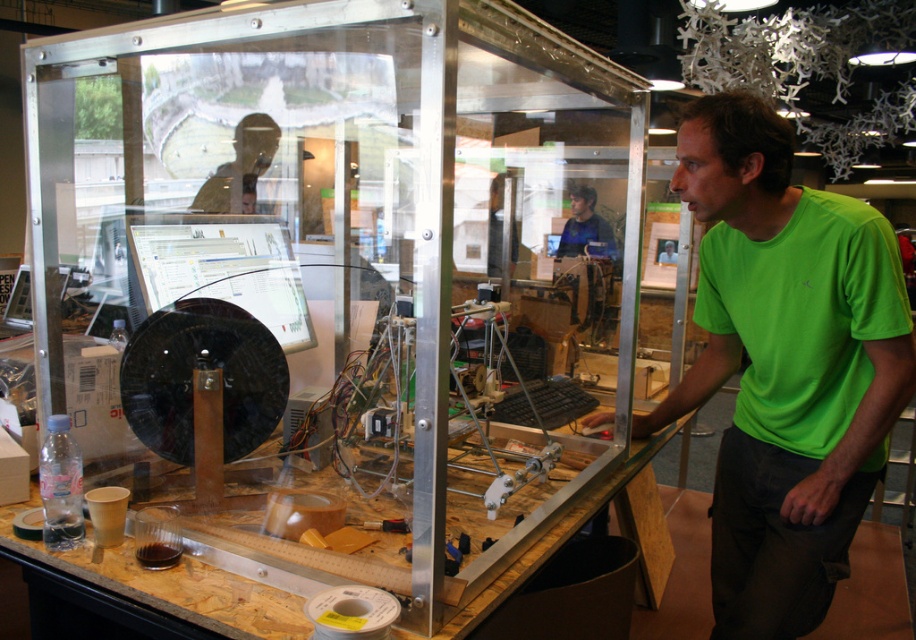
Question: Which point is farther from the camera taking this photo?

Choices:
 (A) (813, 349)
 (B) (367, 550)
 (C) (576, 188)
 (D) (249, 195)

Answer: (C)

Question: Which object is the farthest from the matte black laptop at upper left?

Choices:
 (A) green matte shirt at center
 (B) blue fabric shirt at center
 (C) transparent acrylic glass box at center

Answer: (B)

Question: Does transparent acrylic glass box at center have a larger size compared to green matte shirt at center?

Choices:
 (A) yes
 (B) no

Answer: (A)

Question: Which point appears farthest from the camera in this image?

Choices:
 (A) (240, 200)
 (B) (781, 589)
 (C) (585, 248)

Answer: (C)

Question: Does transparent acrylic glass box at center have a smaller size compared to green matte shirt at center?

Choices:
 (A) no
 (B) yes

Answer: (A)

Question: Does transparent acrylic glass box at center have a larger size compared to blue fabric shirt at center?

Choices:
 (A) no
 (B) yes

Answer: (B)